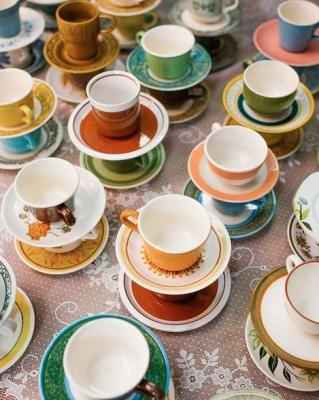
Locate an element on the screen. The height and width of the screenshot is (400, 319). flowers on tablecloth is located at coordinates (33, 372), (191, 378), (224, 378), (245, 382), (109, 274), (95, 268), (122, 197), (148, 194), (110, 200), (66, 146).